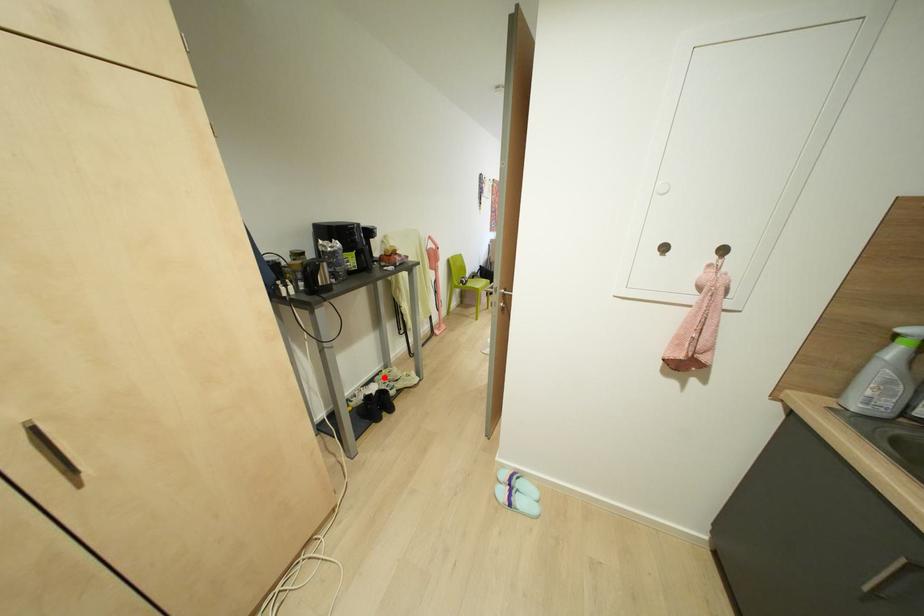
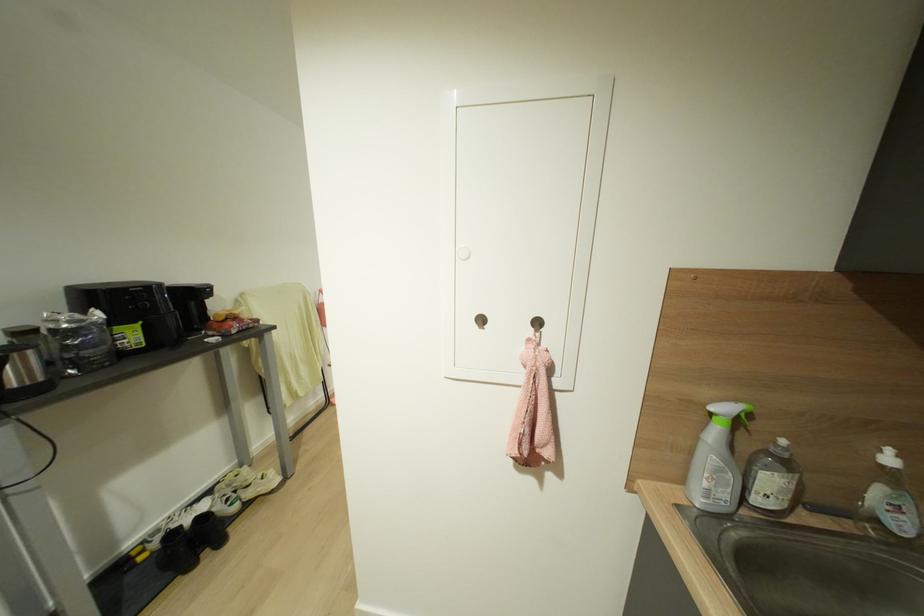
Question: A red point is marked in image1. In image2, is the corresponding 3D point closer to the camera or farther? Reply with the corresponding letter.

Choices:
 (A) The corresponding 3D point is closer.
 (B) The corresponding 3D point is farther.

Answer: (B)